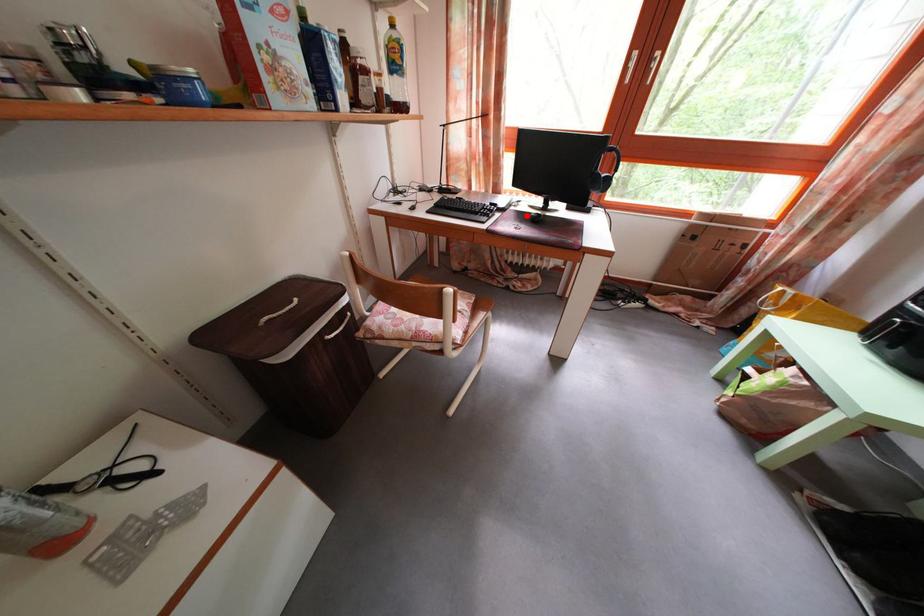
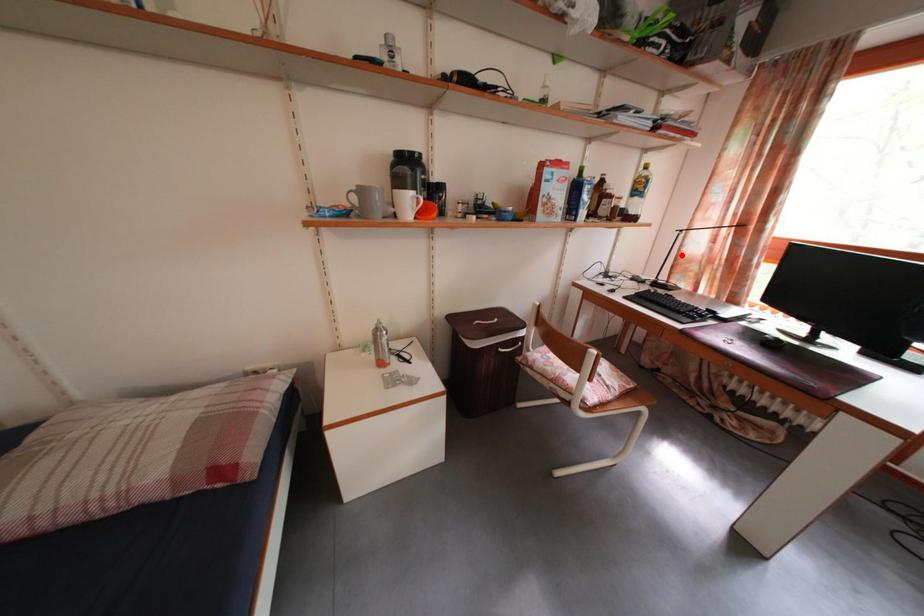
I am providing you with two images of the same scene from different viewpoints. A red point is marked on the first image and another point is marked on the second image. Are the points marked in image1 and image2 representing the same 3D position?

No